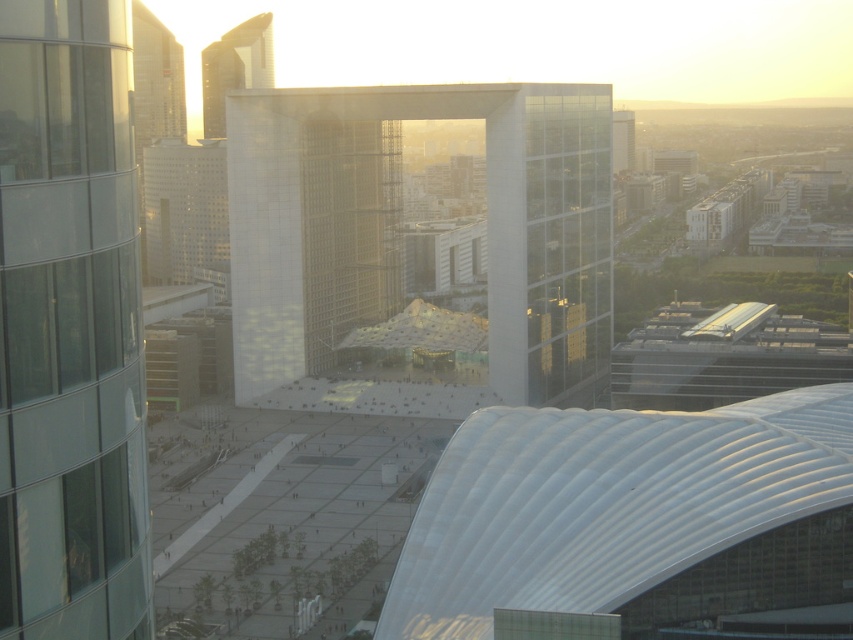
Is transparent glass building at center in front of matte glass skyscraper at upper left?

No, it is not.

How distant is transparent glass building at center from matte glass skyscraper at upper left?

transparent glass building at center is 180.06 meters from matte glass skyscraper at upper left.

Locate an element on the screen. The width and height of the screenshot is (853, 640). transparent glass building at center is located at coordinates (403, 250).

Who is higher up, transparent glass building at center or transparent glass tower at left?

transparent glass building at center

Is point (550, 145) positioned after point (115, 541)?

Yes, point (550, 145) is farther from viewer.

Is point (379, 248) farther from viewer compared to point (64, 161)?

Yes, point (379, 248) is farther from viewer.

Where is `transparent glass building at center`? Image resolution: width=853 pixels, height=640 pixels. transparent glass building at center is located at coordinates (403, 250).

Is transparent glass building at center smaller than white glass building at upper center?

Actually, transparent glass building at center might be larger than white glass building at upper center.

Who is shorter, transparent glass building at center or white glass building at upper center?

white glass building at upper center is shorter.

In order to click on transparent glass building at center in this screenshot , I will do `click(403, 250)`.

Locate an element on the screen. transparent glass building at center is located at coordinates (403, 250).